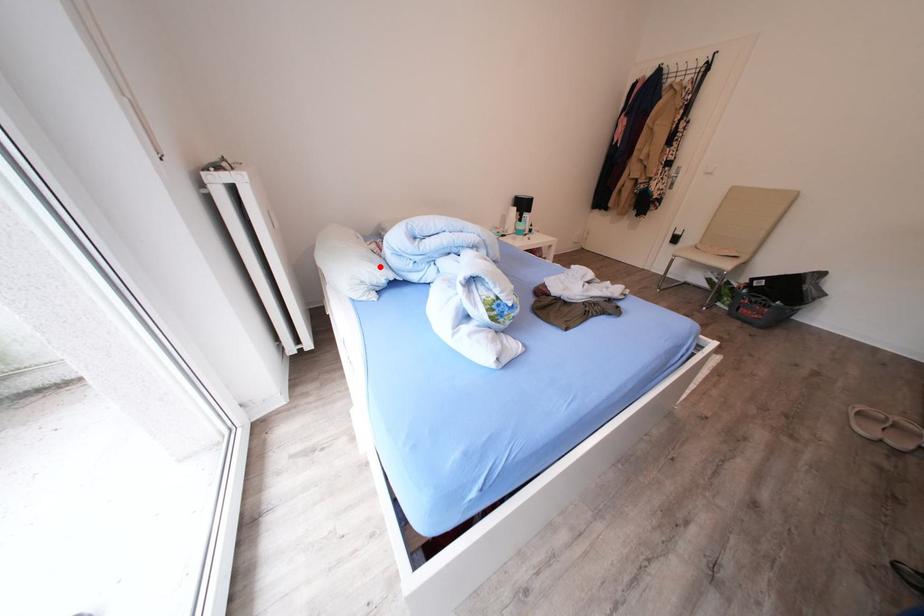
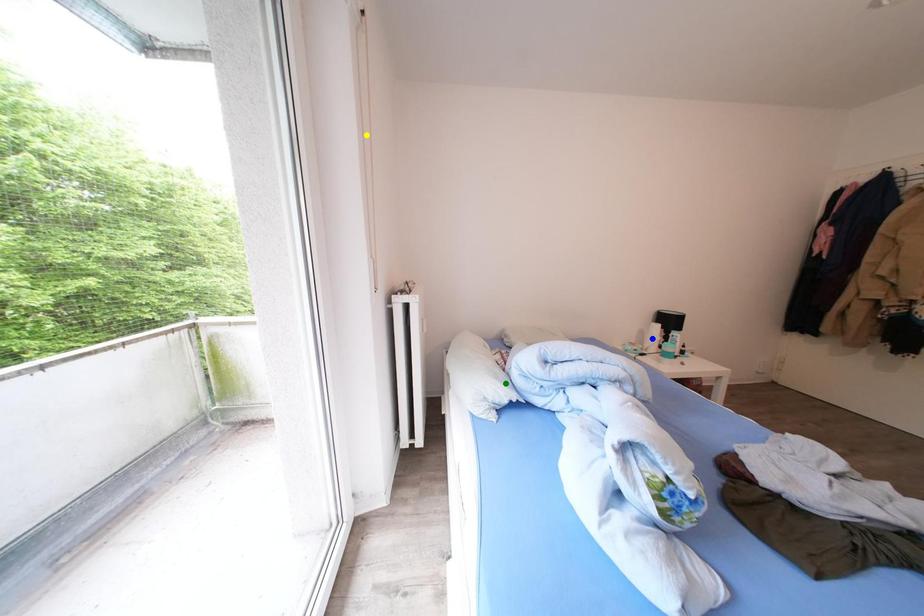
Question: I am providing you with two images of the same scene from different viewpoints. A red point is marked on the first image. You are given multiple points on the second image. In image 2, which mark is for the same physical point as the one in image 1?

Choices:
 (A) blue point
 (B) yellow point
 (C) green point

Answer: (C)